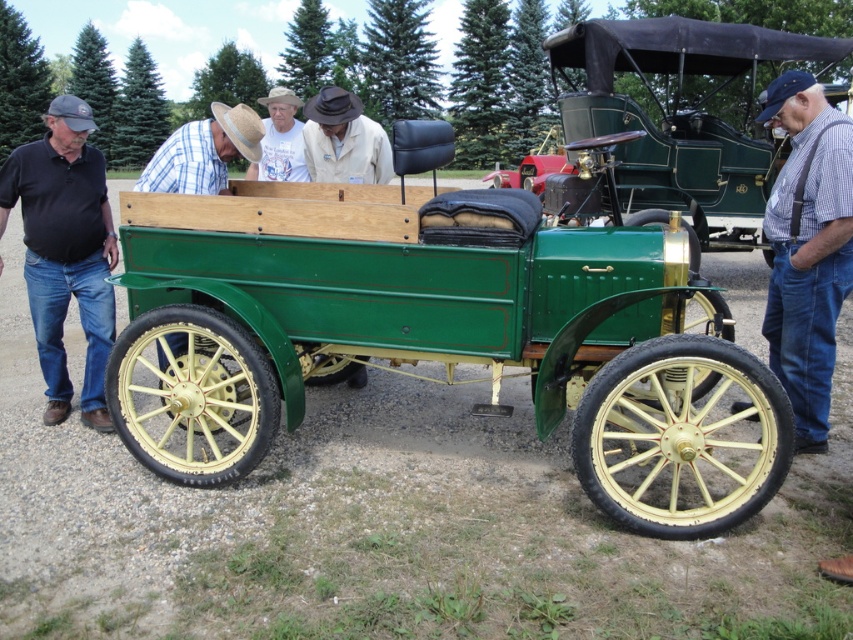
Question: Can you confirm if green polished wood wagon at center is wider than blue plaid shirt at right?

Choices:
 (A) no
 (B) yes

Answer: (B)

Question: Which of the following is the farthest from the observer?

Choices:
 (A) (297, 145)
 (B) (252, 124)
 (C) (24, 157)

Answer: (A)

Question: Observing the image, what is the correct spatial positioning of blue plaid shirt at right in reference to plaid shirt at center?

Choices:
 (A) above
 (B) below

Answer: (B)

Question: Which object appears farthest from the camera in this image?

Choices:
 (A) blue plaid shirt at right
 (B) strawhat at center

Answer: (B)

Question: Among these objects, which one is farthest from the camera?

Choices:
 (A) black cotton shirt at left
 (B) blue plaid shirt at right
 (C) white cotton shirt at center
 (D) green polished wood wagon at center

Answer: (A)

Question: Can you confirm if green polished wood wagon at center is thinner than white cotton shirt at center?

Choices:
 (A) no
 (B) yes

Answer: (B)